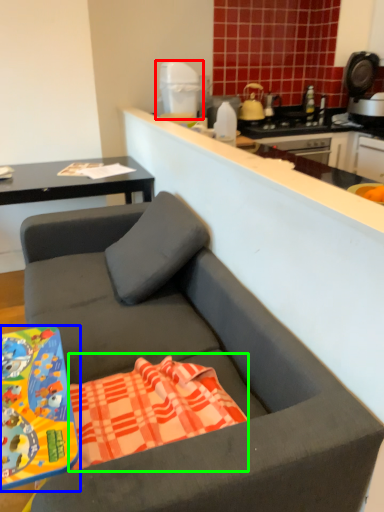
Question: Considering the real-world distances, which object is closest to appliance (highlighted by a red box)? desk (highlighted by a blue box) or beach towel (highlighted by a green box).

Choices:
 (A) desk
 (B) beach towel

Answer: (B)